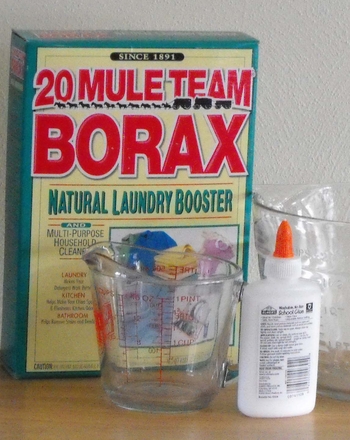
Locate an element on the screen. The width and height of the screenshot is (350, 440). measuring cup is located at coordinates (199, 378).